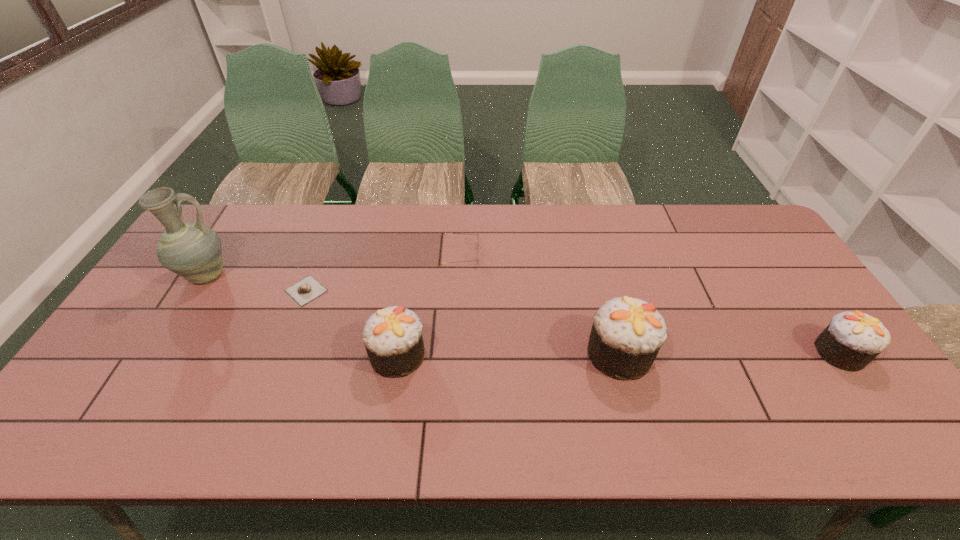
Where is `blank area at the far edge`? blank area at the far edge is located at coordinates (438, 242).

This screenshot has width=960, height=540. In the image, there is a desktop. In order to click on free space at the near edge in this screenshot , I will do `click(509, 394)`.

In the image, there is a desktop. What are the coordinates of `free space at the left edge` in the screenshot? It's located at (180, 325).

I want to click on vacant space at the right edge of the desktop, so click(813, 373).

Identify the location of free space at the far left corner of the desktop. (215, 213).

This screenshot has height=540, width=960. I want to click on vacant space at the far right corner, so click(x=737, y=245).

Find the location of `vacant space in between the pitcher and the fourth object from right to left`. vacant space in between the pitcher and the fourth object from right to left is located at coordinates (302, 315).

Locate an element on the screen. The width and height of the screenshot is (960, 540). empty location between the shortest object and the second cupcake from left to right is located at coordinates (463, 322).

This screenshot has height=540, width=960. What are the coordinates of `vacant area that lies between the rightmost object and the tallest object` in the screenshot? It's located at pos(523,314).

Identify the location of vacant space that is in between the fourth object from left to right and the second cupcake from left to right. This screenshot has width=960, height=540. (540, 304).